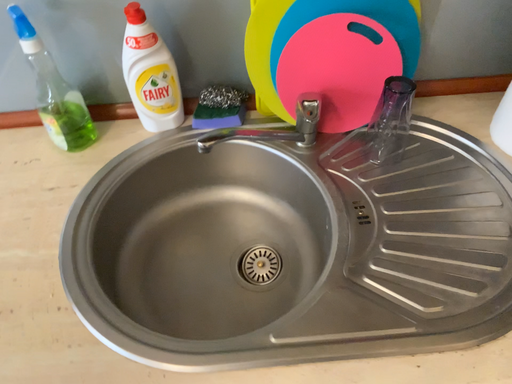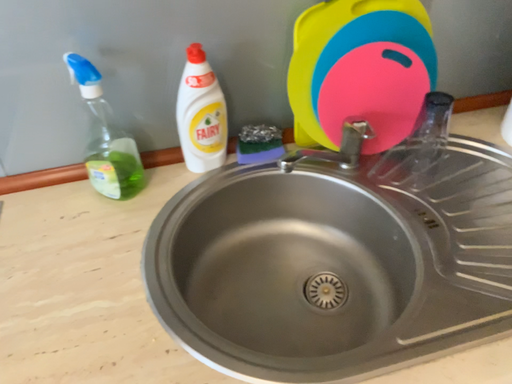
Question: Which way did the camera rotate in the video?

Choices:
 (A) rotated downward
 (B) rotated upward

Answer: (B)